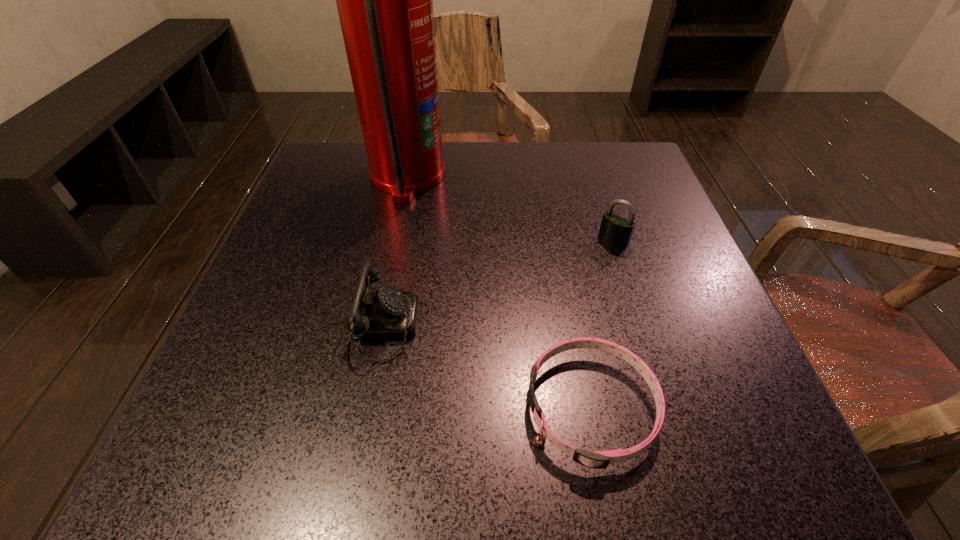
At what (x,y) coordinates should I click in order to perform the action: click on the farthest object. Please return your answer as a coordinate pair (x, y). This screenshot has width=960, height=540. Looking at the image, I should click on (384, 0).

At what (x,y) coordinates should I click in order to perform the action: click on the tallest object. Please return your answer as a coordinate pair (x, y). This screenshot has height=540, width=960. Looking at the image, I should click on (384, 0).

The width and height of the screenshot is (960, 540). Find the location of `padlock`. padlock is located at coordinates (614, 229).

Find the location of a particular element. The width and height of the screenshot is (960, 540). telephone is located at coordinates (387, 314).

Find the location of `dog collar`. dog collar is located at coordinates (600, 459).

In order to click on vacant space positioned on the instruction side of the tallest object in this screenshot , I will do `click(540, 177)`.

At what (x,y) coordinates should I click in order to perform the action: click on vacant position located 0.120m on the back of the padlock. Please return your answer as a coordinate pair (x, y). Image resolution: width=960 pixels, height=540 pixels. Looking at the image, I should click on (600, 197).

At what (x,y) coordinates should I click in order to perform the action: click on free space located on the front-facing side of the telephone. Please return your answer as a coordinate pair (x, y). The width and height of the screenshot is (960, 540). Looking at the image, I should click on (492, 316).

At what (x,y) coordinates should I click in order to perform the action: click on free space located with the buckle on the dog collar. Please return your answer as a coordinate pair (x, y). The height and width of the screenshot is (540, 960). Looking at the image, I should click on (277, 408).

I want to click on vacant space located with the buckle on the dog collar, so click(x=256, y=408).